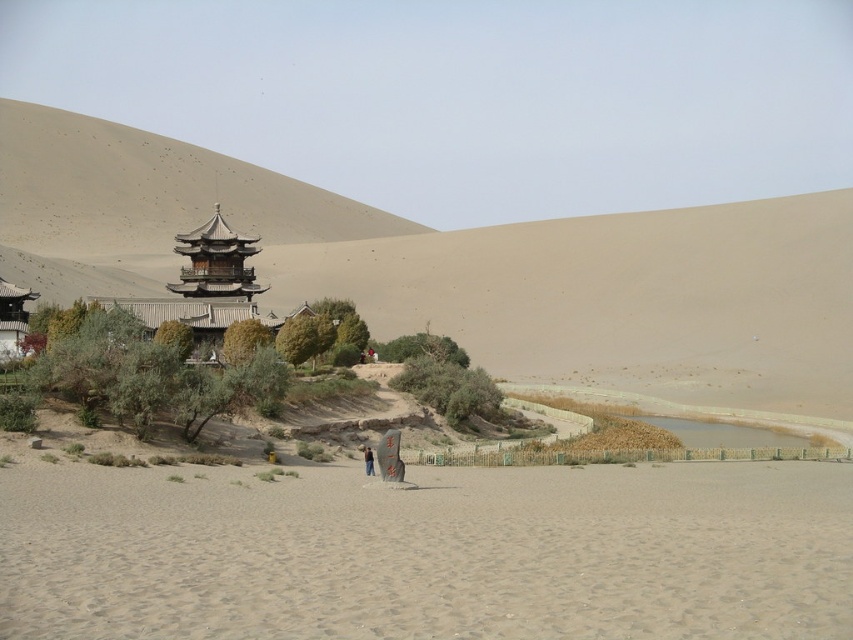
You are standing at the origin point in the desert scene. A drone needs to fly to the smooth sand at lower center. What are the coordinates where the drone should land?

The smooth sand at lower center is located at coordinates point (428, 554), so the drone should land there.